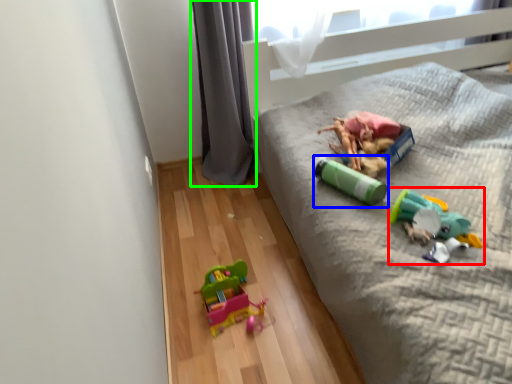
Question: Which object is the closest to the toy (highlighted by a red box)? Choose among these: toy (highlighted by a blue box) or curtain (highlighted by a green box).

Choices:
 (A) toy
 (B) curtain

Answer: (A)